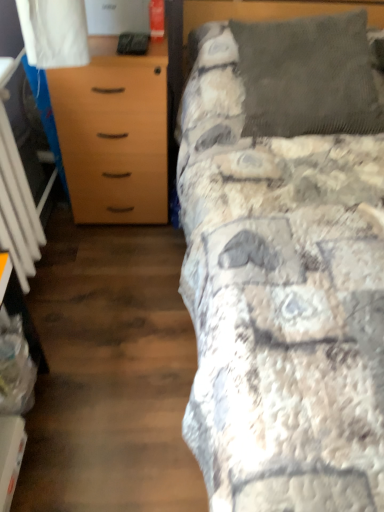
Question: From a real-world perspective, is dark gray corduroy pillow at upper right beneath textured gray blanket at upper right?

Choices:
 (A) no
 (B) yes

Answer: (A)

Question: Does dark gray corduroy pillow at upper right appear on the right side of textured gray blanket at upper right?

Choices:
 (A) no
 (B) yes

Answer: (A)

Question: Is dark gray corduroy pillow at upper right with textured gray blanket at upper right?

Choices:
 (A) yes
 (B) no

Answer: (B)

Question: Does dark gray corduroy pillow at upper right have a lesser height compared to textured gray blanket at upper right?

Choices:
 (A) no
 (B) yes

Answer: (B)

Question: Does dark gray corduroy pillow at upper right come in front of textured gray blanket at upper right?

Choices:
 (A) yes
 (B) no

Answer: (B)

Question: Could you tell me if dark gray corduroy pillow at upper right is turned towards textured gray blanket at upper right?

Choices:
 (A) yes
 (B) no

Answer: (A)

Question: Does white plastic radiator at left have a larger size compared to textured gray blanket at upper right?

Choices:
 (A) no
 (B) yes

Answer: (A)

Question: Is white plastic radiator at left thinner than textured gray blanket at upper right?

Choices:
 (A) no
 (B) yes

Answer: (B)

Question: Considering the relative sizes of white plastic radiator at left and textured gray blanket at upper right in the image provided, is white plastic radiator at left smaller than textured gray blanket at upper right?

Choices:
 (A) no
 (B) yes

Answer: (B)

Question: Is white plastic radiator at left outside of textured gray blanket at upper right?

Choices:
 (A) yes
 (B) no

Answer: (A)

Question: Is white plastic radiator at left aimed at textured gray blanket at upper right?

Choices:
 (A) no
 (B) yes

Answer: (B)

Question: From the image's perspective, is white plastic radiator at left located above textured gray blanket at upper right?

Choices:
 (A) yes
 (B) no

Answer: (B)

Question: Does textured gray blanket at upper right have a lesser width compared to light brown wood chest of drawers at left?

Choices:
 (A) no
 (B) yes

Answer: (A)